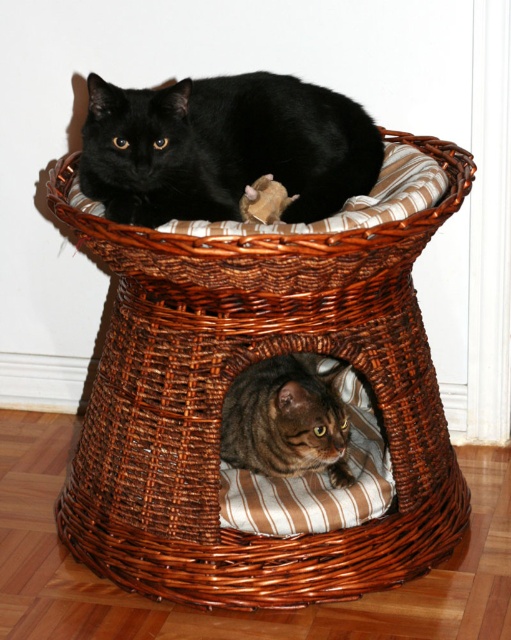
You are a cat owner who wants to place a new toy inside the brown wicker basket at center. The toy is the same size as the tabby fur cat at upper center. Will the toy fit inside the basket?

The brown wicker basket at center is larger in size than the tabby fur cat at upper center, so the toy will fit inside the basket.

You are a cat owner who wants to place a new toy in the brown wicker basket at center. If your cat is 1 foot tall, will it be able to see the toy once placed inside the basket?

The brown wicker basket at center is 4.95 feet away from the viewer. Since the cat is only 1 foot tall, it may not be able to see the toy placed inside the basket from that distance unless it moves closer.

You are a cat owner who wants to ensure both cats in the wicker pet bed are comfortable. Given that the tabby fur cat at upper center is larger than the tabby fur cat at center, which cat might need a larger space to stretch out comfortably?

The tabby fur cat at upper center is bigger than the tabby fur cat at center, so it might need a larger space to stretch out comfortably.